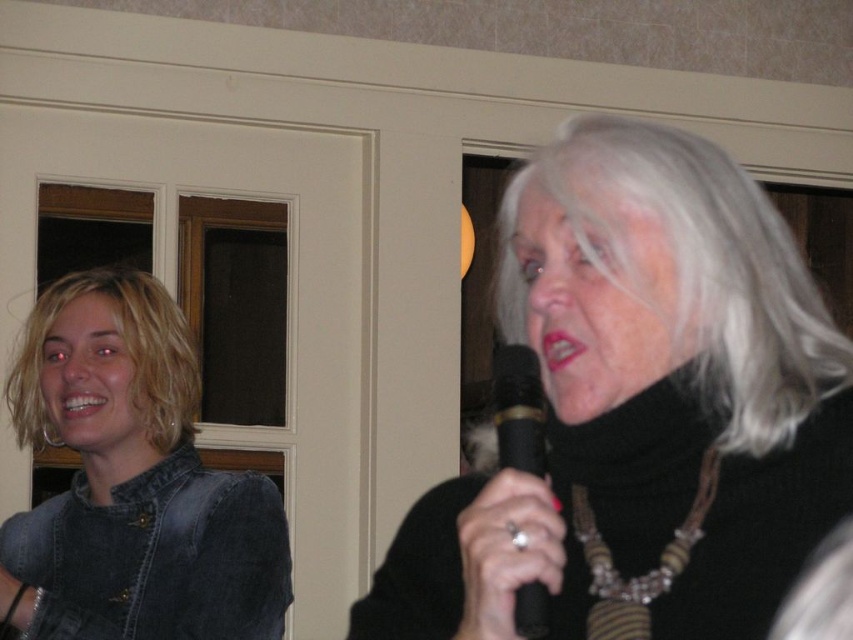
You are a photographer at the event and want to take a picture of the person on the left. To ensure the denim jacket at left and blondehair at left are both clearly visible, which part of the person should be in focus?

The denim jacket at left is below blondehair at left, so focusing on the upper body where the blondehair at left is located will ensure both the denim jacket at left and the blondehair at left are in focus.

You are a photographer standing 1.5 meters away from the denim jacket at left. You want to take a photo of the black matte microphone at center without moving the subjects. Is the microphone within your camera lens range if your camera can focus as close as 0.5 meters?

The black matte microphone at center is 1.03 meters away from the denim jacket at left. Since you are 1.5 meters away from the denim jacket at left, the total distance to the microphone would be 1.5 meters minus 1.03 meters, which equals 0.47 meters. However, your camera can only focus as close as 0.5 meters. Therefore, the microphone is just slightly out of focus range.

You are a photographer at a party and need to position a camera to capture both the black matte microphone at center and the denim jacket at left clearly. Considering their heights, which object should be placed closer to the camera to ensure both are in focus?

The black matte microphone at center has a lesser height compared to denim jacket at left, so to ensure both are in focus, the microphone should be placed closer to the camera since it is shorter and might require less depth of field adjustment.